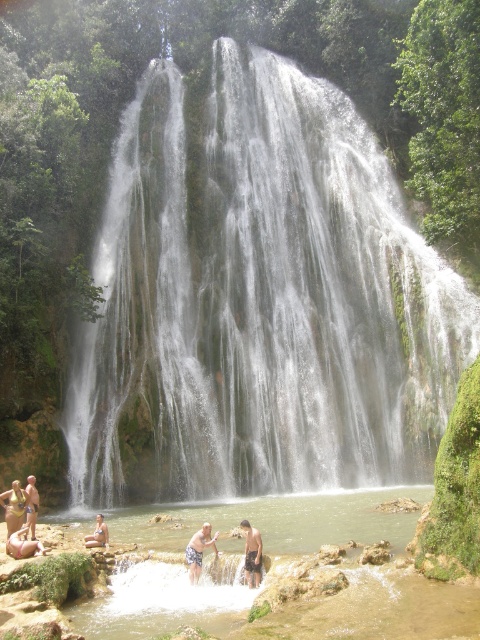
Question: Estimate the real-world distances between objects in this image. Which object is closer to the beige sand person at lower left?

Choices:
 (A) tan skin human at lower center
 (B) tan skin person at lower left

Answer: (B)

Question: Can you confirm if matte yellow bikini at lower left is wider than tan skin human at lower center?

Choices:
 (A) yes
 (B) no

Answer: (A)

Question: Is white smooth waterfall at center to the left of tan skin person at lower center from the viewer's perspective?

Choices:
 (A) no
 (B) yes

Answer: (A)

Question: Which object is farther from the camera taking this photo?

Choices:
 (A) tan skin person at lower center
 (B) matte yellow bikini at lower left
 (C) beige sand person at lower left

Answer: (B)

Question: Can you confirm if white smooth waterfall at center is positioned to the left of tan skin human at lower center?

Choices:
 (A) no
 (B) yes

Answer: (A)

Question: Which object is positioned closest to the tan skin person at lower left?

Choices:
 (A) white smooth waterfall at center
 (B) beige sand person at lower left
 (C) matte yellow bikini at lower left
 (D) tan skin human at lower center

Answer: (C)